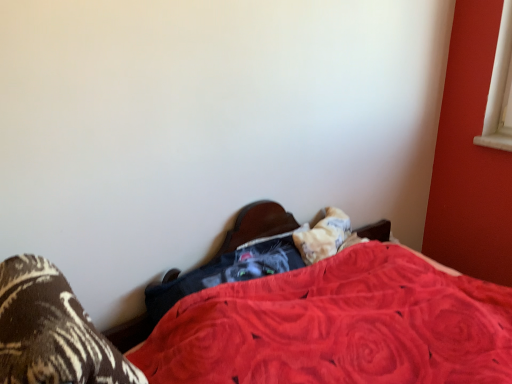
Question: From a real-world perspective, is brown textured socks at lower left physically above fluffy white pillow at lower center?

Choices:
 (A) no
 (B) yes

Answer: (B)

Question: Is brown textured socks at lower left not close to fluffy white pillow at lower center?

Choices:
 (A) yes
 (B) no

Answer: (B)

Question: Is the position of brown textured socks at lower left more distant than that of fluffy white pillow at lower center?

Choices:
 (A) no
 (B) yes

Answer: (A)

Question: From a real-world perspective, is brown textured socks at lower left physically below fluffy white pillow at lower center?

Choices:
 (A) no
 (B) yes

Answer: (A)

Question: Can you confirm if brown textured socks at lower left is smaller than fluffy white pillow at lower center?

Choices:
 (A) yes
 (B) no

Answer: (B)

Question: Is point (50, 292) closer or farther from the camera than point (169, 304)?

Choices:
 (A) farther
 (B) closer

Answer: (B)

Question: Is velvet red blanket at center wider or thinner than velvet-like black cat at center?

Choices:
 (A) thin
 (B) wide

Answer: (B)

Question: Is velvet red blanket at center spatially inside velvet-like black cat at center, or outside of it?

Choices:
 (A) inside
 (B) outside

Answer: (B)

Question: Relative to velvet-like black cat at center, is velvet red blanket at center in front or behind?

Choices:
 (A) behind
 (B) front

Answer: (B)

Question: From the image's perspective, is fluffy white pillow at lower center positioned above or below brown textured socks at lower left?

Choices:
 (A) below
 (B) above

Answer: (B)

Question: Relative to brown textured socks at lower left, is fluffy white pillow at lower center in front or behind?

Choices:
 (A) front
 (B) behind

Answer: (B)

Question: Visually, is fluffy white pillow at lower center positioned to the left or to the right of brown textured socks at lower left?

Choices:
 (A) left
 (B) right

Answer: (B)

Question: Is point (333, 246) positioned closer to the camera than point (97, 352)?

Choices:
 (A) closer
 (B) farther

Answer: (B)

Question: Does point (73, 360) appear closer or farther from the camera than point (202, 345)?

Choices:
 (A) farther
 (B) closer

Answer: (B)

Question: Is brown textured socks at lower left spatially inside velvet red blanket at center, or outside of it?

Choices:
 (A) outside
 (B) inside

Answer: (A)